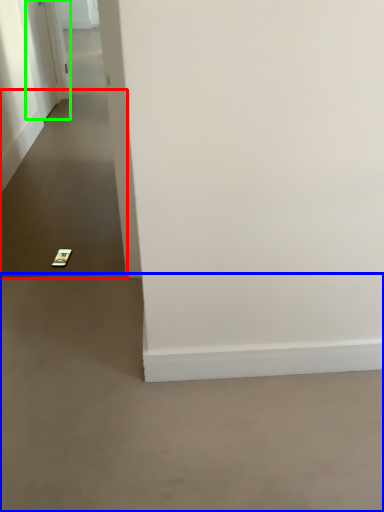
Question: Which object is the farthest from path (highlighted by a red box)? Choose among these: concrete (highlighted by a blue box) or door (highlighted by a green box).

Choices:
 (A) concrete
 (B) door

Answer: (A)